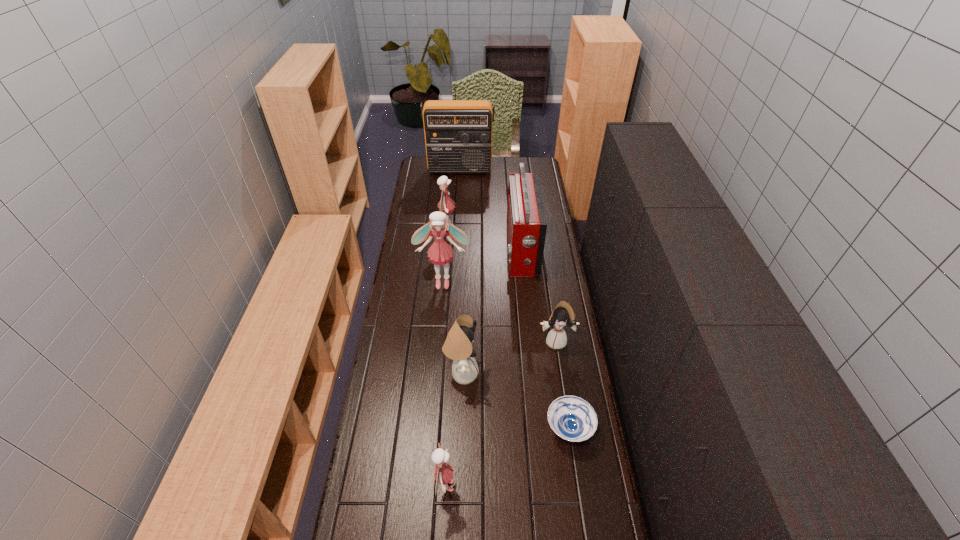
At what (x,y) coordinates should I click in order to perform the action: click on object positioned at the far left corner. Please return your answer as a coordinate pair (x, y). The width and height of the screenshot is (960, 540). Looking at the image, I should click on (458, 133).

You are a GUI agent. You are given a task and a screenshot of the screen. Output one action in this format:
    pyautogui.click(x=<x>, y=<y>)
    Task: Click on the vacant space at the far edge
    
    Given the screenshot: What is the action you would take?
    [475, 177]

Find the location of a particular element. free region at the left edge of the desktop is located at coordinates (411, 278).

In the image, there is a desktop. At what (x,y) coordinates should I click in order to perform the action: click on vacant space at the right edge. Please return your answer as a coordinate pair (x, y). The width and height of the screenshot is (960, 540). Looking at the image, I should click on (582, 534).

In order to click on vacant space at the far right corner in this screenshot , I will do `click(531, 168)`.

The height and width of the screenshot is (540, 960). What are the coordinates of `free spot between the right black doll and the right radio receiver` in the screenshot? It's located at (539, 295).

The width and height of the screenshot is (960, 540). In order to click on free space between the seventh farthest object and the left radio receiver in this screenshot , I will do `click(515, 299)`.

Where is `free space between the second biggest pink doll and the farther radio receiver`? This screenshot has height=540, width=960. free space between the second biggest pink doll and the farther radio receiver is located at coordinates (454, 199).

The width and height of the screenshot is (960, 540). Find the location of `free space that is in between the farther radio receiver and the farthest pink doll`. free space that is in between the farther radio receiver and the farthest pink doll is located at coordinates (454, 199).

Where is `empty space that is in between the second smallest pink doll and the left radio receiver`? Image resolution: width=960 pixels, height=540 pixels. empty space that is in between the second smallest pink doll and the left radio receiver is located at coordinates (454, 199).